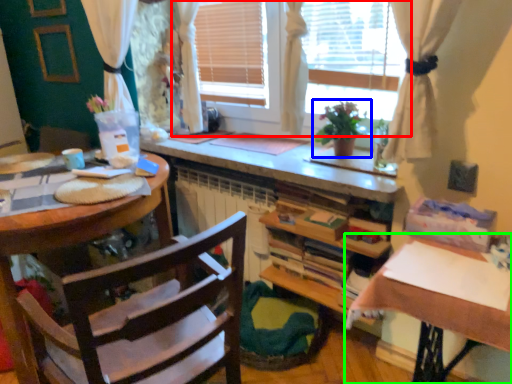
Question: Which object is positioned closest to window (highlighted by a red box)? Select from houseplant (highlighted by a blue box) and table (highlighted by a green box).

Choices:
 (A) houseplant
 (B) table

Answer: (A)